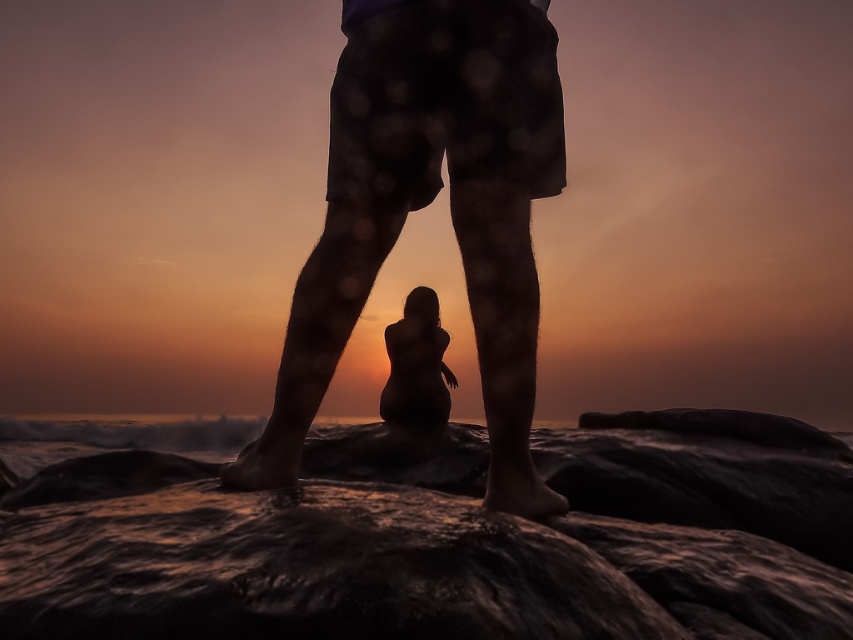
Question: From the image, what is the correct spatial relationship of sandy water at lower center in relation to silhouette shorts at center?

Choices:
 (A) right
 (B) left

Answer: (A)

Question: Based on their relative distances, which object is farther from the silhouette figure at center?

Choices:
 (A) sandy water at lower center
 (B) silhouette shorts at center

Answer: (A)

Question: Which object appears farthest from the camera in this image?

Choices:
 (A) sandy water at lower center
 (B) silhouette figure at center

Answer: (B)

Question: Does sandy water at lower center have a lesser width compared to silhouette shorts at center?

Choices:
 (A) yes
 (B) no

Answer: (A)

Question: Which object is closer to the camera taking this photo?

Choices:
 (A) silhouette figure at center
 (B) sandy water at lower center

Answer: (B)

Question: Is silhouette shorts at center smaller than silhouette figure at center?

Choices:
 (A) yes
 (B) no

Answer: (B)